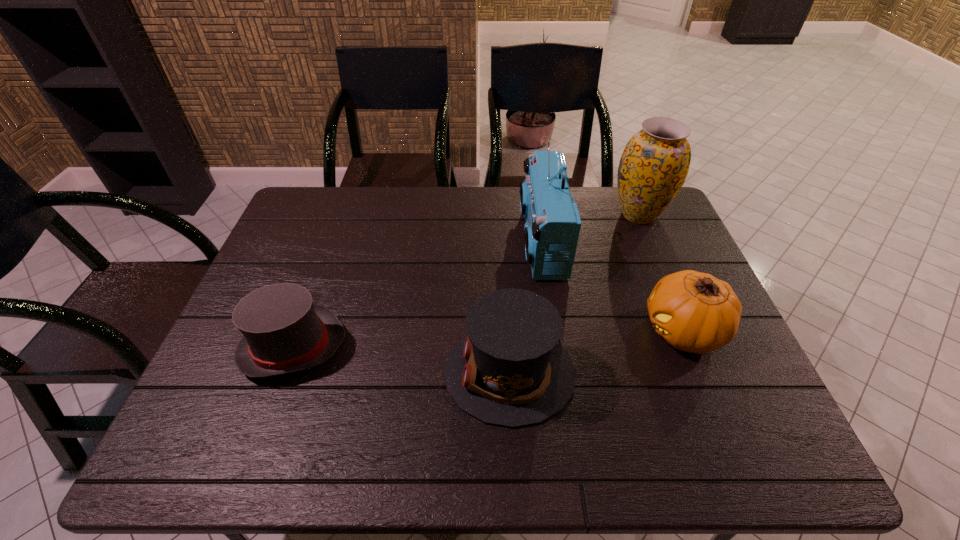
Find the location of a particular element. The image size is (960, 540). free region at the near right corner of the desktop is located at coordinates (766, 431).

Where is `vacant space in between the vase and the pumpkin`? This screenshot has width=960, height=540. vacant space in between the vase and the pumpkin is located at coordinates (660, 273).

I want to click on unoccupied position between the radio receiver and the pumpkin, so click(x=612, y=286).

The height and width of the screenshot is (540, 960). What are the coordinates of `vacant point located between the radio receiver and the vase` in the screenshot? It's located at (590, 228).

Find the location of a particular element. The height and width of the screenshot is (540, 960). vacant region between the left dress hat and the right dress hat is located at coordinates (401, 359).

The width and height of the screenshot is (960, 540). What are the coordinates of `empty location between the right dress hat and the shortest object` in the screenshot? It's located at (401, 359).

Locate an element on the screen. The height and width of the screenshot is (540, 960). free spot between the shortest object and the taller dress hat is located at coordinates (401, 359).

The image size is (960, 540). I want to click on empty location between the vase and the right dress hat, so click(574, 293).

At what (x,y) coordinates should I click in order to perform the action: click on object that is the closest to the taller dress hat. Please return your answer as a coordinate pair (x, y). Looking at the image, I should click on (552, 228).

Identify which object is located as the nearest to the radio receiver. Please provide its 2D coordinates. Your answer should be formatted as a tuple, i.e. [(x, y)], where the tuple contains the x and y coordinates of a point satisfying the conditions above.

[(509, 370)]